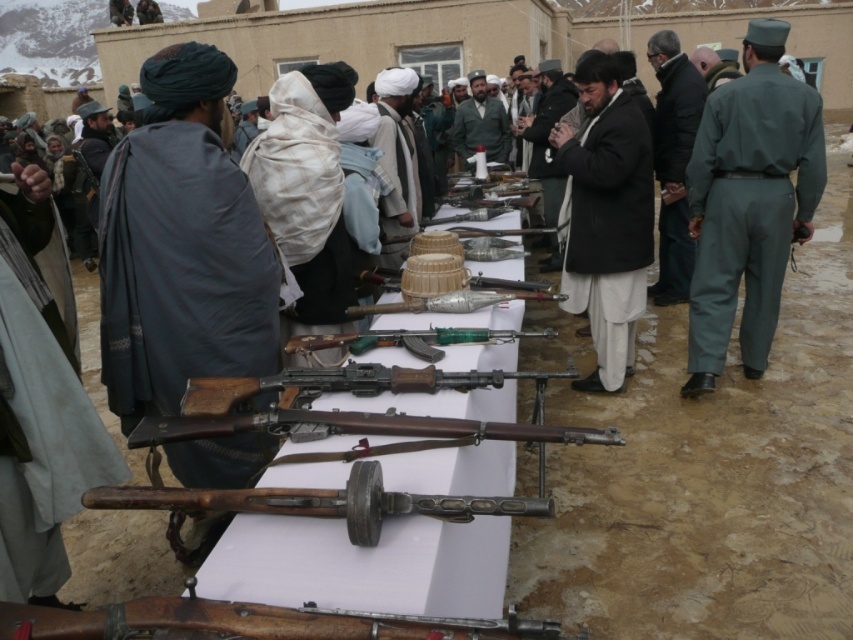
You are a tailor observing the black woolen robe at center and dark brown woolen coat at center. Which clothing item is shorter in height?

The black woolen robe at center is not as tall as the dark brown woolen coat at center, so the black woolen robe at center is shorter in height.

From the picture: You are a photographer trying to capture a clear image of the dark gray woolen robe at left and the rusty wood rifle at center. Since you want both items to be in focus, you need to know their positions relative to each other. Based on the scene, which object is positioned higher up?

The dark gray woolen robe at left is above the rusty wood rifle at center, so it is positioned higher up.

In the scene shown: You are a photographer at the event and need to position yourself so that both the black woolen robe at center and the dark brown woolen coat at center are visible in your shot. Based on their positions, which one should be closer to the left side of your camera frame?

The black woolen robe at center is to the left of the dark brown woolen coat at center, so it should be closer to the left side of your camera frame.